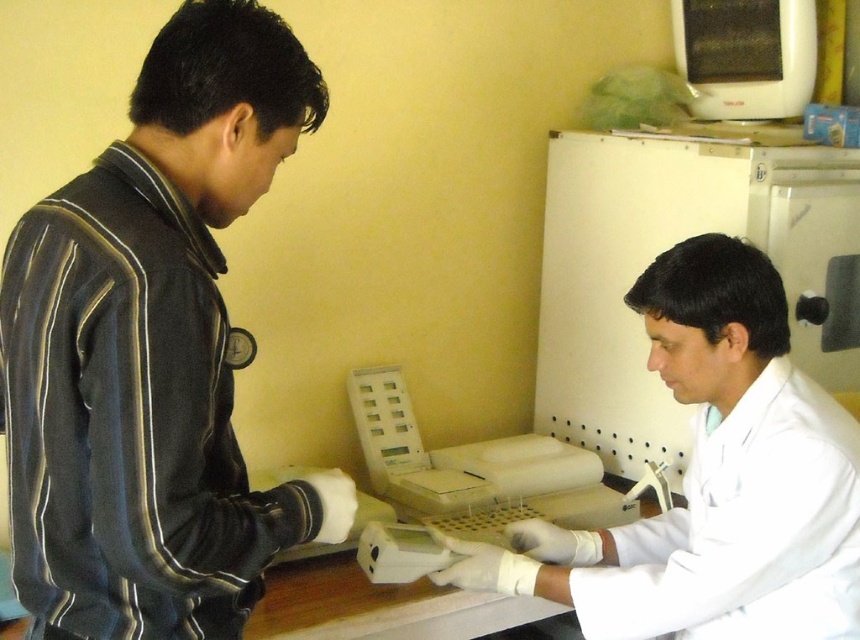
Is white lab coat at center shorter than black plastic microwave at upper right?

Incorrect, white lab coat at center's height does not fall short of black plastic microwave at upper right's.

Does point (805, 496) lie behind point (689, 16)?

No, (805, 496) is in front of (689, 16).

Is point (627, 616) in front of point (806, 72)?

Yes, point (627, 616) is in front of point (806, 72).

You are a GUI agent. You are given a task and a screenshot of the screen. Output one action in this format:
    pyautogui.click(x=<x>, y=<y>)
    Task: Click on the white lab coat at center
    The width and height of the screenshot is (860, 640).
    Given the screenshot: What is the action you would take?
    pyautogui.click(x=711, y=481)

Between point (234, 616) and point (692, 109), which one is positioned in front?

Point (234, 616) is in front.

Is point (158, 557) less distant than point (796, 112)?

Yes, it is in front of point (796, 112).

Where is `dark blue fabric jacket at left`? The height and width of the screenshot is (640, 860). dark blue fabric jacket at left is located at coordinates point(152,352).

Does dark blue fabric jacket at left appear over white lab coat at center?

Indeed, dark blue fabric jacket at left is positioned over white lab coat at center.

In the scene shown: Is dark blue fabric jacket at left bigger than white lab coat at center?

No, dark blue fabric jacket at left is not bigger than white lab coat at center.

Is point (43, 486) farther from camera compared to point (776, 428)?

No, it is not.

At what (x,y) coordinates should I click in order to perform the action: click on dark blue fabric jacket at left. Please return your answer as a coordinate pair (x, y). The height and width of the screenshot is (640, 860). Looking at the image, I should click on (152, 352).